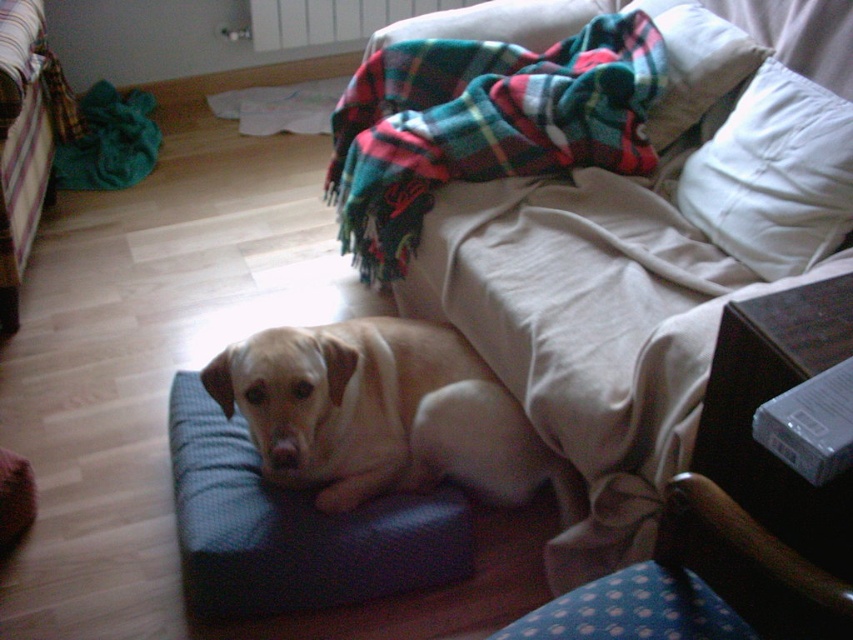
Is blue fabric dog bed at center below white soft pillow at upper right?

Correct, blue fabric dog bed at center is located below white soft pillow at upper right.

Looking at this image, between blue fabric dog bed at center and white soft pillow at upper right, which one has more height?

With more height is white soft pillow at upper right.

I want to click on blue fabric dog bed at center, so click(293, 528).

Who is lower down, plaid woolen blanket at upper center or white soft pillow at upper right?

white soft pillow at upper right is below.

Is plaid woolen blanket at upper center thinner than white soft pillow at upper right?

No, plaid woolen blanket at upper center is not thinner than white soft pillow at upper right.

This screenshot has height=640, width=853. Find the location of `plaid woolen blanket at upper center`. plaid woolen blanket at upper center is located at coordinates [x=482, y=124].

Locate an element on the screen. This screenshot has height=640, width=853. plaid woolen blanket at upper center is located at coordinates (482, 124).

Between light beige fur at center and white soft pillow at upper right, which one is positioned higher?

white soft pillow at upper right

Does light beige fur at center have a larger size compared to white soft pillow at upper right?

Correct, light beige fur at center is larger in size than white soft pillow at upper right.

Measure the distance between light beige fur at center and camera.

4.78 feet

Where is `light beige fur at center`? light beige fur at center is located at coordinates (383, 413).